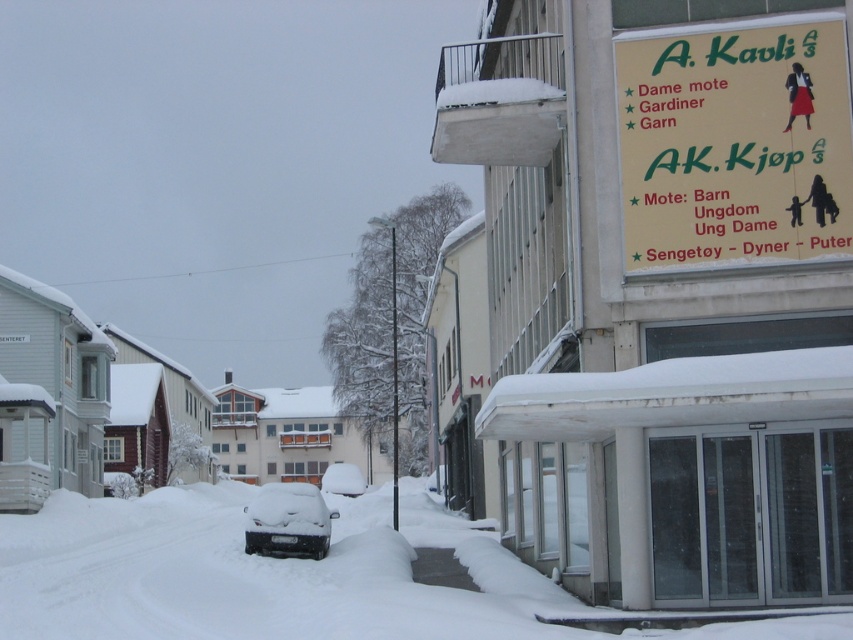
Can you confirm if yellow paper sign at upper right is smaller than snow-covered car at center?

Yes.

Image resolution: width=853 pixels, height=640 pixels. Describe the element at coordinates (734, 141) in the screenshot. I see `yellow paper sign at upper right` at that location.

Identify the location of yellow paper sign at upper right. (734, 141).